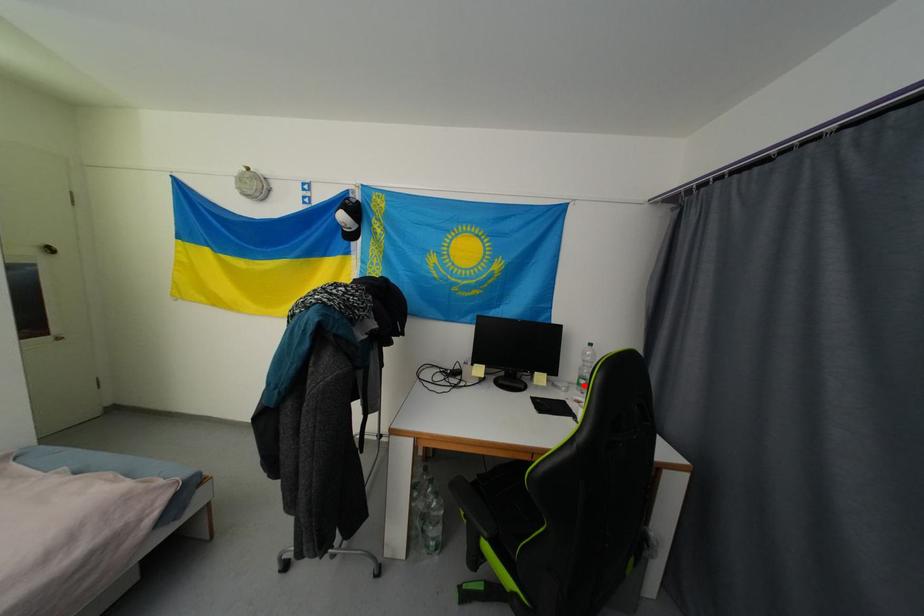
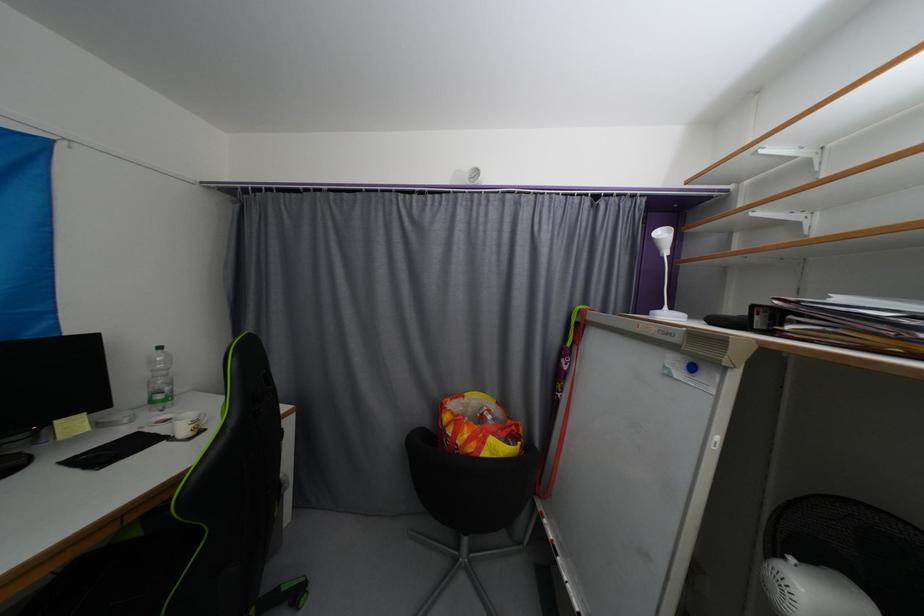
In the second image, find the point that corresponds to the highlighted location in the first image.

(157, 403)